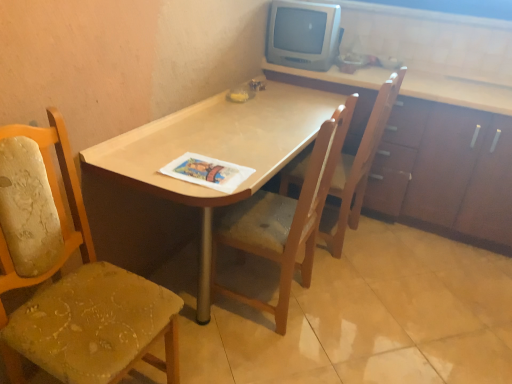
Question: In the image, is wooden cabinet at upper right positioned in front of or behind wooden chair at center, the third chair viewed from the left?

Choices:
 (A) behind
 (B) front

Answer: (A)

Question: Considering the positions of point (488, 218) and point (337, 170), is point (488, 218) closer or farther from the camera than point (337, 170)?

Choices:
 (A) closer
 (B) farther

Answer: (B)

Question: Which is farther from the printed paper magazine at center?

Choices:
 (A) wooden chair at center, which is counted as the second chair, starting from the right
 (B) worn fabric chair at left, which appears as the 1th chair when viewed from the left
 (C) wooden cabinet at upper right
 (D) wooden chair at center, placed as the 1th chair when sorted from right to left
 (E) light wood desk at center

Answer: (C)

Question: Which of these objects is positioned farthest from the printed paper magazine at center?

Choices:
 (A) worn fabric chair at left, which is the 3th chair in right-to-left order
 (B) light wood desk at center
 (C) wooden chair at center, placed as the 1th chair when sorted from right to left
 (D) wooden chair at center, which is counted as the second chair, starting from the right
 (E) wooden cabinet at upper right

Answer: (E)